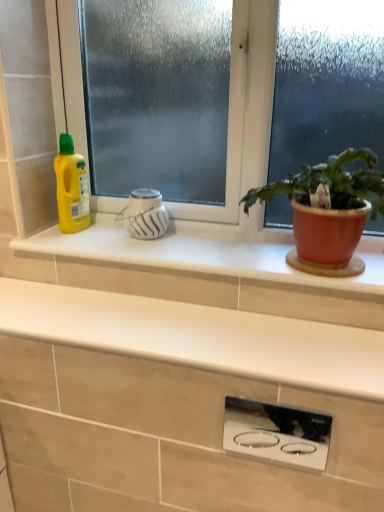
Question: In which direction should I rotate to look at white glossy vase at center, acting as the 1th appliance starting from the top?

Choices:
 (A) right
 (B) left

Answer: (B)

Question: From a real-world perspective, is white glossy vase at center, the 2th appliance positioned from the right, physically above white matte countertop at center?

Choices:
 (A) no
 (B) yes

Answer: (B)

Question: Could you tell me if white glossy vase at center, which ranks as the 1th appliance in left-to-right order, is turned towards white matte countertop at center?

Choices:
 (A) no
 (B) yes

Answer: (A)

Question: From a real-world perspective, is white glossy vase at center, which ranks as the 2th appliance in bottom-to-top order, beneath white matte countertop at center?

Choices:
 (A) yes
 (B) no

Answer: (B)

Question: Is white glossy vase at center, the 2th appliance positioned from the right, bigger than white matte countertop at center?

Choices:
 (A) yes
 (B) no

Answer: (B)

Question: Is white glossy vase at center, the 2th appliance positioned from the right, with white matte countertop at center?

Choices:
 (A) yes
 (B) no

Answer: (B)

Question: Is white matte countertop at center at the back of white glossy vase at center, the first appliance positioned from the back?

Choices:
 (A) yes
 (B) no

Answer: (B)

Question: Does white glossy vase at center, which ranks as the 2th appliance in bottom-to-top order, come in front of frosted glass window at center?

Choices:
 (A) no
 (B) yes

Answer: (A)

Question: Can you confirm if white glossy vase at center, the first appliance positioned from the back, is bigger than frosted glass window at center?

Choices:
 (A) yes
 (B) no

Answer: (B)

Question: Is the surface of white glossy vase at center, which ranks as the 2th appliance in bottom-to-top order, in direct contact with frosted glass window at center?

Choices:
 (A) yes
 (B) no

Answer: (B)

Question: Does white glossy vase at center, which ranks as the 2th appliance in bottom-to-top order, have a greater height compared to frosted glass window at center?

Choices:
 (A) no
 (B) yes

Answer: (A)

Question: Does white glossy vase at center, the 2th appliance positioned from the right, contain frosted glass window at center?

Choices:
 (A) yes
 (B) no

Answer: (B)

Question: Does white glossy vase at center, which ranks as the 1th appliance in left-to-right order, have a greater width compared to frosted glass window at center?

Choices:
 (A) yes
 (B) no

Answer: (A)

Question: Is polished stainless steel cooktop at center, the 2th appliance when ordered from top to bottom, inside matte terracotta pot at right?

Choices:
 (A) no
 (B) yes

Answer: (A)